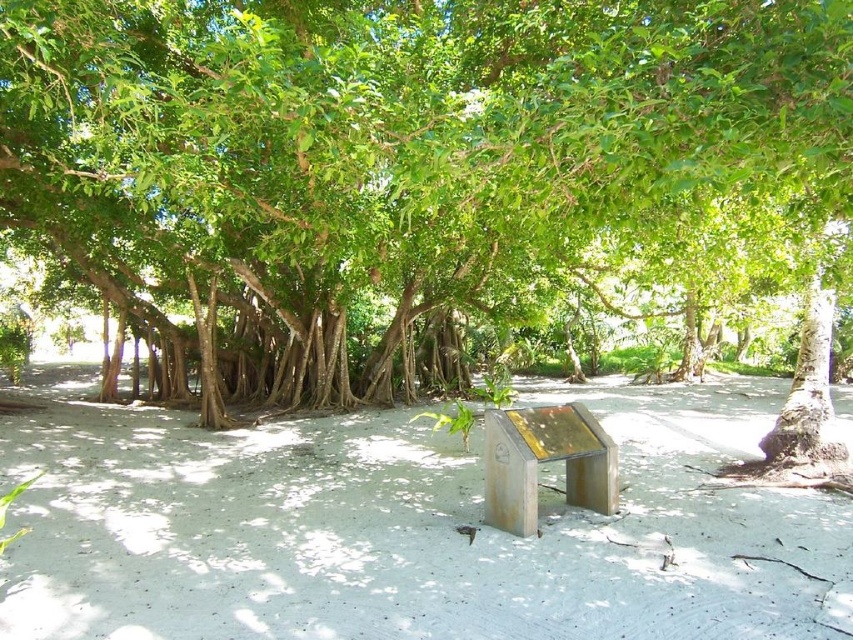
Question: Can you confirm if green leafy tree at center is smaller than white sandy soil at center?

Choices:
 (A) yes
 (B) no

Answer: (B)

Question: Which point is closer to the camera?

Choices:
 (A) white sandy soil at center
 (B) green leafy tree at center

Answer: (B)

Question: Is green leafy tree at center positioned in front of white sandy soil at center?

Choices:
 (A) no
 (B) yes

Answer: (B)

Question: Which point is farther to the camera?

Choices:
 (A) (322, 51)
 (B) (287, 547)

Answer: (B)

Question: Does green leafy tree at center have a smaller size compared to white sandy soil at center?

Choices:
 (A) yes
 (B) no

Answer: (B)